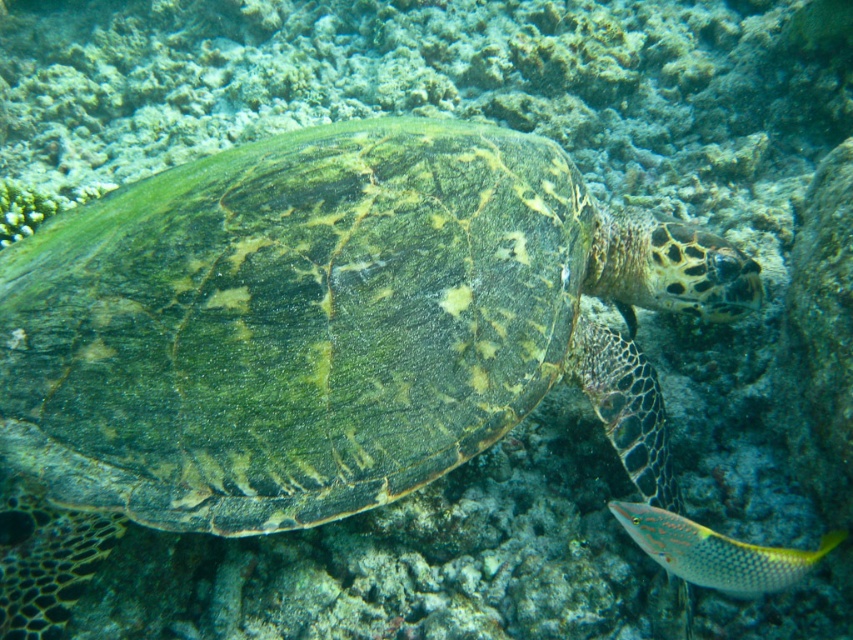
Is green textured shell at center to the right of shiny yellow fish at lower right from the viewer's perspective?

Incorrect, green textured shell at center is not on the right side of shiny yellow fish at lower right.

This screenshot has width=853, height=640. Identify the location of green textured shell at center. (317, 337).

Find the location of `green textured shell at center`. green textured shell at center is located at coordinates (317, 337).